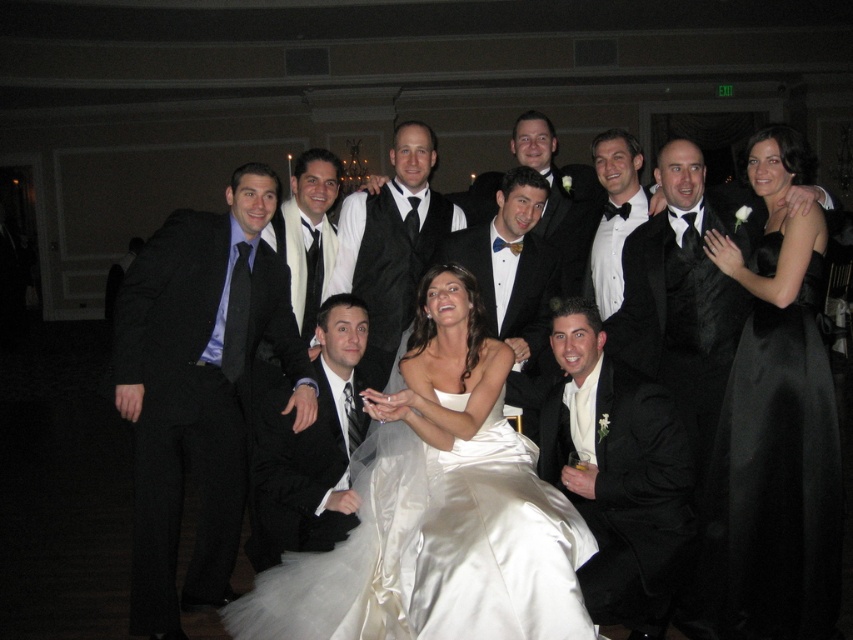
Question: Among these points, which one is nearest to the camera?

Choices:
 (A) (451, 234)
 (B) (577, 406)
 (C) (521, 310)

Answer: (B)

Question: Which of these objects is positioned closest to the black satin bow tie at center?

Choices:
 (A) satin white dress at center
 (B) matte black tuxedo at center

Answer: (B)

Question: Can you confirm if satin black dress at upper right is positioned to the left of shiny black suit at lower right?

Choices:
 (A) no
 (B) yes

Answer: (A)

Question: Does satin dress at center have a lesser width compared to matte black tuxedo at center?

Choices:
 (A) no
 (B) yes

Answer: (A)

Question: Is satin white dress at center below shiny black vest at center?

Choices:
 (A) yes
 (B) no

Answer: (A)

Question: Which object is closer to the camera taking this photo?

Choices:
 (A) matte black tuxedo at center
 (B) shiny black vest at center
 (C) black satin bow tie at upper center
 (D) shiny black suit at center

Answer: (D)